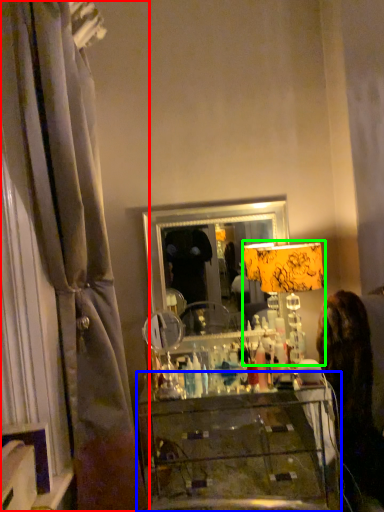
Question: Which is farther away from curtain (highlighted by a red box)? furniture (highlighted by a blue box) or table lamp (highlighted by a green box)?

Choices:
 (A) furniture
 (B) table lamp

Answer: (A)